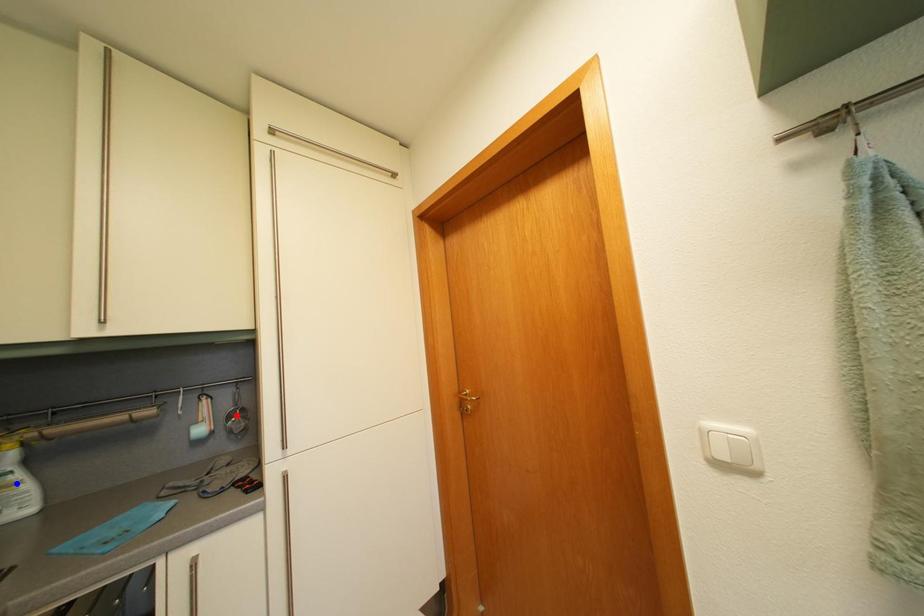
Question: Which of the two points in the image is closer to the camera?

Choices:
 (A) Blue point is closer.
 (B) Red point is closer.

Answer: (A)